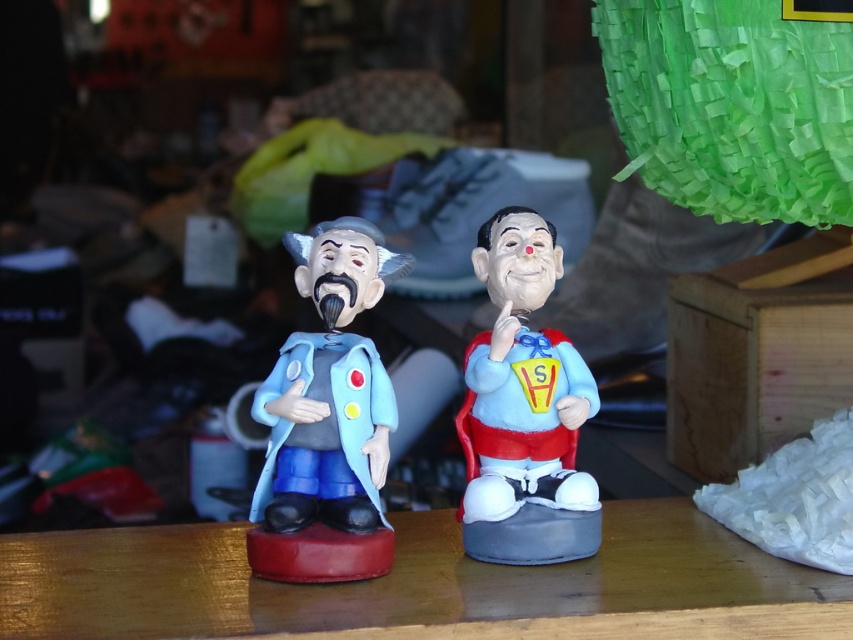
Between wooden table at center and matte plastic clown at center, which one appears on the left side from the viewer's perspective?

From the viewer's perspective, wooden table at center appears more on the left side.

Is point (515, 582) more distant than point (508, 330)?

No, (515, 582) is closer to viewer.

Locate an element on the screen. The height and width of the screenshot is (640, 853). wooden table at center is located at coordinates [421, 586].

Is matte clay figurine at center to the right of matte plastic clown at center from the viewer's perspective?

Incorrect, matte clay figurine at center is not on the right side of matte plastic clown at center.

Between point (314, 538) and point (535, 241), which one is positioned behind?

Positioned behind is point (535, 241).

Describe the element at coordinates (328, 419) in the screenshot. I see `matte clay figurine at center` at that location.

This screenshot has height=640, width=853. I want to click on matte clay figurine at center, so click(328, 419).

Between wooden table at center and matte clay figurine at center, which one appears on the left side from the viewer's perspective?

From the viewer's perspective, matte clay figurine at center appears more on the left side.

Between wooden table at center and matte clay figurine at center, which one has less height?

With less height is wooden table at center.

Describe the element at coordinates (421, 586) in the screenshot. This screenshot has height=640, width=853. I see `wooden table at center` at that location.

Where is `wooden table at center`? The width and height of the screenshot is (853, 640). wooden table at center is located at coordinates (421, 586).